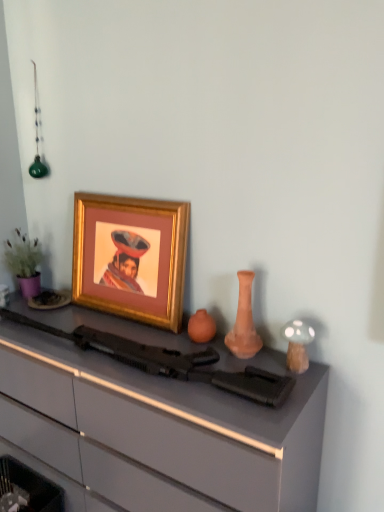
This screenshot has width=384, height=512. Identify the location of matte gray desk at center. (159, 430).

What do you see at coordinates (172, 362) in the screenshot? This screenshot has width=384, height=512. I see `matte black rifle at center` at bounding box center [172, 362].

Locate an element on the screen. gold-framed picture at upper left is located at coordinates (131, 257).

At what (x,y) coordinates should I click in order to perform the action: click on terracotta vase at center. Please return your answer as a coordinate pair (x, y). This screenshot has width=384, height=512. Looking at the image, I should click on (244, 322).

Could you tell me if matte black rifle at center is facing matte gray desk at center?

No.

Is matte black rifle at center far away from matte gray desk at center?

No, matte black rifle at center is not far away from matte gray desk at center.

From the image's perspective, which is above, matte black rifle at center or matte gray desk at center?

matte black rifle at center is shown above in the image.

Who is shorter, matte black rifle at center or matte gray desk at center?

matte black rifle at center.

Who is more distant, matte gray desk at center or gold-framed picture at upper left?

gold-framed picture at upper left is more distant.

Considering the sizes of matte gray desk at center and gold-framed picture at upper left in the image, is matte gray desk at center bigger or smaller than gold-framed picture at upper left?

In the image, matte gray desk at center appears to be larger than gold-framed picture at upper left.

From the image's perspective, relative to gold-framed picture at upper left, is matte gray desk at center above or below?

Clearly, from the image's perspective, matte gray desk at center is below gold-framed picture at upper left.

Does matte gray desk at center have a lesser width compared to gold-framed picture at upper left?

In fact, matte gray desk at center might be wider than gold-framed picture at upper left.

Is point (242, 296) closer or farther from the camera than point (69, 475)?

Point (242, 296).

Locate an element on the screen. The height and width of the screenshot is (512, 384). vase above the matte gray desk at center (from a real-world perspective) is located at coordinates (244, 322).

Which object is wider, terracotta vase at center or matte gray desk at center?

Wider between the two is matte gray desk at center.

Between terracotta vase at center and matte gray desk at center, which one has more height?

Standing taller between the two is matte gray desk at center.

Which is further, (14, 319) or (294, 358)?

The point (14, 319) is farther.

Consider the image. Does matte black rifle at center have a greater width compared to white glossy mushroom at right?

Correct, the width of matte black rifle at center exceeds that of white glossy mushroom at right.

Does matte black rifle at center turn towards white glossy mushroom at right?

No, matte black rifle at center is not turned towards white glossy mushroom at right.

Is matte black rifle at center further to the viewer compared to white glossy mushroom at right?

No, matte black rifle at center is closer to the camera.

Is matte gray desk at center positioned beyond the bounds of matte black rifle at center?

Absolutely, matte gray desk at center is external to matte black rifle at center.

Is matte gray desk at center oriented towards matte black rifle at center?

No, matte gray desk at center does not turn towards matte black rifle at center.

Does point (94, 485) come behind point (80, 335)?

Yes, it is.

Is terracotta vase at center looking in the opposite direction of gold-framed picture at upper left?

No, gold-framed picture at upper left is not at the back of terracotta vase at center.

Image resolution: width=384 pixels, height=512 pixels. What are the coordinates of `picture frame located behind the terracotta vase at center` in the screenshot? It's located at click(x=131, y=257).

Does terracotta vase at center have a lesser width compared to gold-framed picture at upper left?

Incorrect, the width of terracotta vase at center is not less than that of gold-framed picture at upper left.

Would you say terracotta vase at center is a long distance from gold-framed picture at upper left?

That's not correct — terracotta vase at center is a little close to gold-framed picture at upper left.

Measure the distance from matte black rifle at center to terracotta vase at center.

matte black rifle at center and terracotta vase at center are 9.77 inches apart from each other.

Can you confirm if matte black rifle at center is bigger than terracotta vase at center?

Indeed, matte black rifle at center has a larger size compared to terracotta vase at center.

Which object is closer to the camera taking this photo, matte black rifle at center or terracotta vase at center?

matte black rifle at center is more forward.

Locate an element on the screen. The width and height of the screenshot is (384, 512). desk on the left side of matte black rifle at center is located at coordinates (159, 430).

Image resolution: width=384 pixels, height=512 pixels. I want to click on desk in front of the gold-framed picture at upper left, so click(x=159, y=430).

Considering their positions, is matte gray desk at center positioned further to terracotta vase at center than matte black rifle at center?

matte gray desk at center.

Which object lies nearer to the anchor point terracotta vase at center, matte gray desk at center or gold-framed picture at upper left?

gold-framed picture at upper left is positioned closer to the anchor terracotta vase at center.

Looking at the image, which one is located further to white glossy mushroom at right, gold-framed picture at upper left or matte black rifle at center?

Based on the image, gold-framed picture at upper left appears to be further to white glossy mushroom at right.

Based on their spatial positions, is terracotta vase at center or matte gray desk at center closer to white glossy mushroom at right?

terracotta vase at center lies closer to white glossy mushroom at right than the other object.

Estimate the real-world distances between objects in this image. Which object is closer to gold-framed picture at upper left, matte gray desk at center or matte black rifle at center?

matte black rifle at center.

Considering their positions, is gold-framed picture at upper left positioned closer to matte gray desk at center than terracotta vase at center?

The object closer to matte gray desk at center is gold-framed picture at upper left.

In the scene shown: Based on their spatial positions, is terracotta vase at center or white glossy mushroom at right further from matte black rifle at center?

white glossy mushroom at right is further to matte black rifle at center.

From the image, which object appears to be nearer to white glossy mushroom at right, matte gray desk at center or gold-framed picture at upper left?

matte gray desk at center is positioned closer to the anchor white glossy mushroom at right.

This screenshot has width=384, height=512. What are the coordinates of `vase between gold-framed picture at upper left and white glossy mushroom at right` in the screenshot? It's located at (244, 322).

Locate an element on the screen. rifle situated between gold-framed picture at upper left and white glossy mushroom at right from left to right is located at coordinates (172, 362).

Find the location of a particular element. The width and height of the screenshot is (384, 512). vase situated between matte gray desk at center and white glossy mushroom at right from left to right is located at coordinates (244, 322).

The image size is (384, 512). I want to click on rifle between gold-framed picture at upper left and matte gray desk at center in the up-down direction, so click(172, 362).